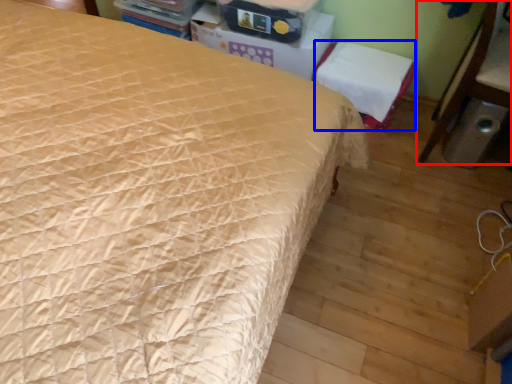
Question: Which object appears farthest to the camera in this image, furniture (highlighted by a red box) or chair (highlighted by a blue box)?

Choices:
 (A) furniture
 (B) chair

Answer: (B)